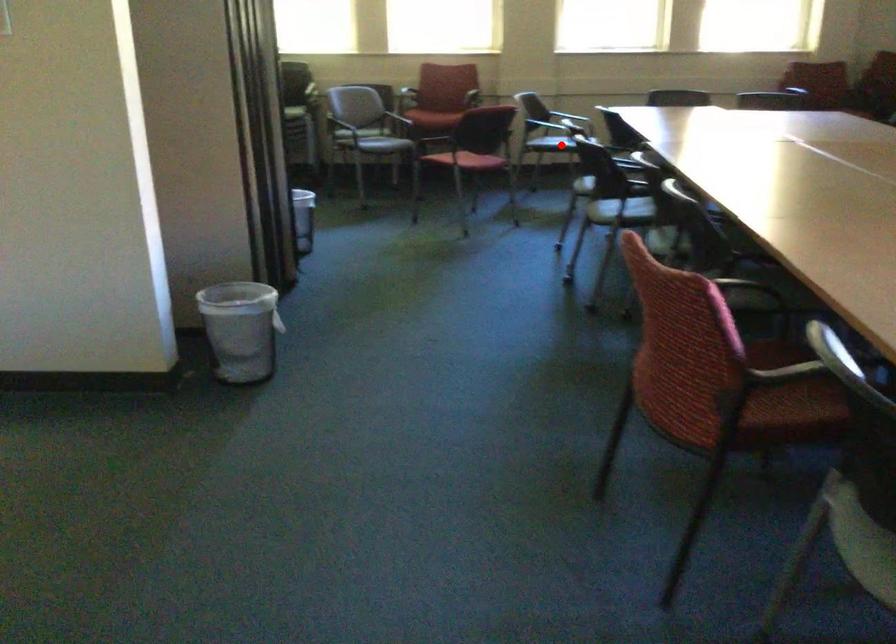
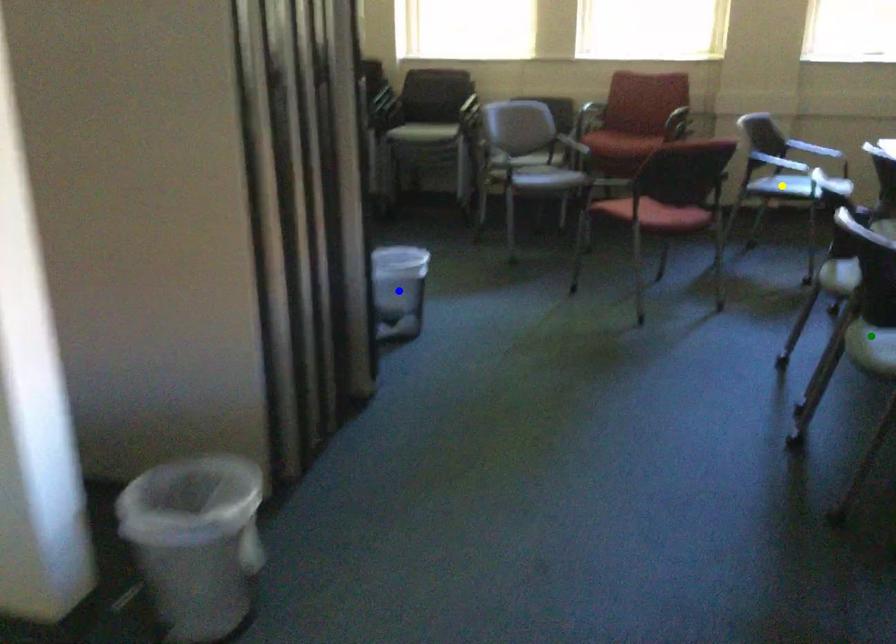
Question: I am providing you with two images of the same scene from different viewpoints. A red point is marked on the first image. You are given multiple points on the second image. Which spot in image 2 lines up with the point in image 1?

Choices:
 (A) blue point
 (B) green point
 (C) yellow point

Answer: (C)